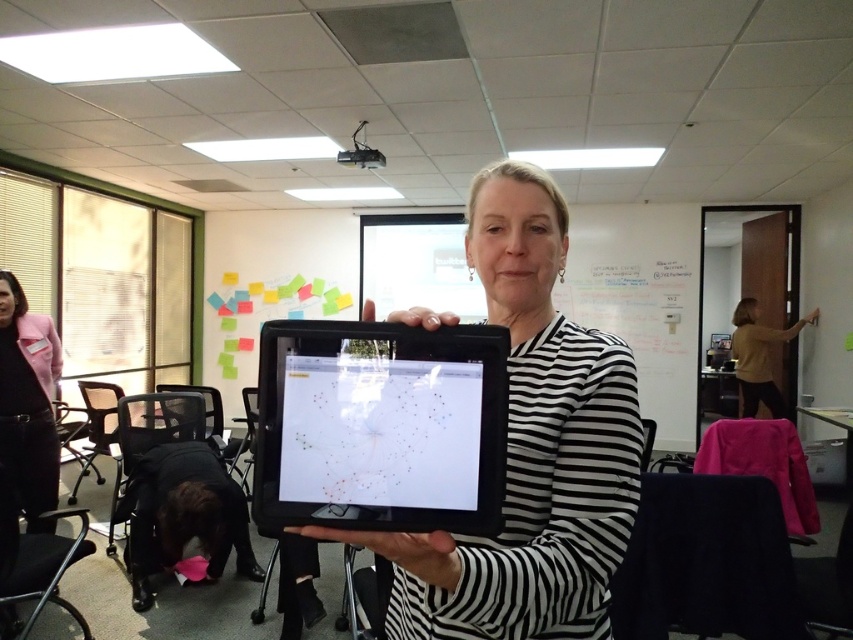
Question: Among these objects, which one is farthest from the camera?

Choices:
 (A) white matte whiteboard at upper center
 (B) matte brown sweater at right
 (C) black glossy tablet at center
 (D) black matte tablet at center

Answer: (A)

Question: Which point is farther from the camera taking this photo?

Choices:
 (A) (456, 454)
 (B) (602, 220)
 (C) (500, 221)
 (D) (741, 365)

Answer: (B)

Question: Does white matte whiteboard at upper center appear under matte brown sweater at right?

Choices:
 (A) yes
 (B) no

Answer: (B)

Question: Can you confirm if black matte tablet at center is bigger than white matte whiteboard at upper center?

Choices:
 (A) no
 (B) yes

Answer: (A)

Question: Is white matte whiteboard at upper center further to the viewer compared to matte brown sweater at right?

Choices:
 (A) yes
 (B) no

Answer: (A)

Question: Estimate the real-world distances between objects in this image. Which object is farther from the matte brown sweater at right?

Choices:
 (A) black matte tablet at center
 (B) white matte whiteboard at upper center

Answer: (A)